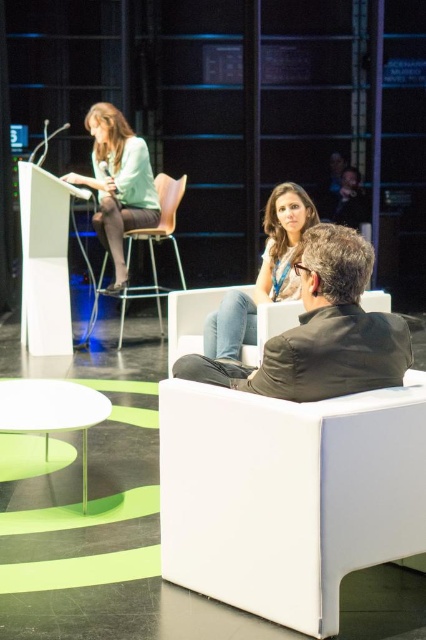
Question: Is matte white chair at center above white plastic stool at lower left?

Choices:
 (A) no
 (B) yes

Answer: (B)

Question: Which point is closer to the camera taking this photo?

Choices:
 (A) (239, 314)
 (B) (121, 221)

Answer: (A)

Question: Which object is the farthest from the matte black stool at center?

Choices:
 (A) matte white chair at center
 (B) white plastic stool at lower left

Answer: (B)

Question: From the image, what is the correct spatial relationship of matte white chair at center in relation to matte black stool at center?

Choices:
 (A) right
 (B) left

Answer: (A)

Question: Considering the real-world distances, which object is farthest from the dark brown leather jacket at center?

Choices:
 (A) matte black stool at center
 (B) white plastic stool at lower left

Answer: (A)

Question: Can you confirm if matte green shirt at upper left is smaller than white plastic stool at lower left?

Choices:
 (A) no
 (B) yes

Answer: (A)